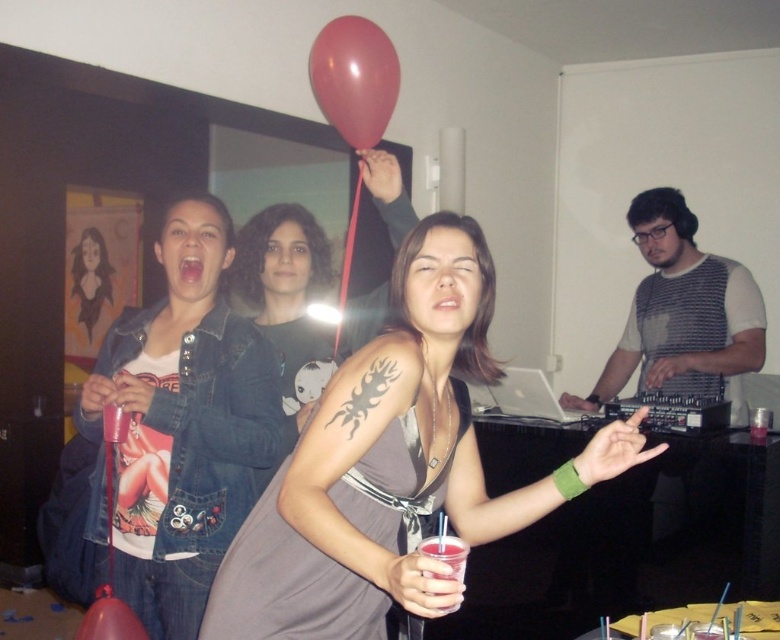
Question: Which object appears closest to the camera in this image?

Choices:
 (A) denim jacket at upper left
 (B) rubber balloon at lower left
 (C) translucent plastic cup at lower center

Answer: (C)

Question: Where is denim jacket at upper left located in relation to rubber balloon at lower left in the image?

Choices:
 (A) above
 (B) below

Answer: (A)

Question: Which of these objects is positioned closest to the rubber balloon at upper center?

Choices:
 (A) rubber balloon at lower left
 (B) matte gray dress at center

Answer: (B)

Question: Does rubber balloon at upper center appear over translucent plastic cup at lower center?

Choices:
 (A) yes
 (B) no

Answer: (A)

Question: Is rubber balloon at upper center thinner than translucent plastic cup at lower center?

Choices:
 (A) yes
 (B) no

Answer: (B)

Question: Which object appears closest to the camera in this image?

Choices:
 (A) rubber balloon at lower left
 (B) matte black dress at center
 (C) rubber balloon at upper center
 (D) translucent plastic cup at lower center

Answer: (D)